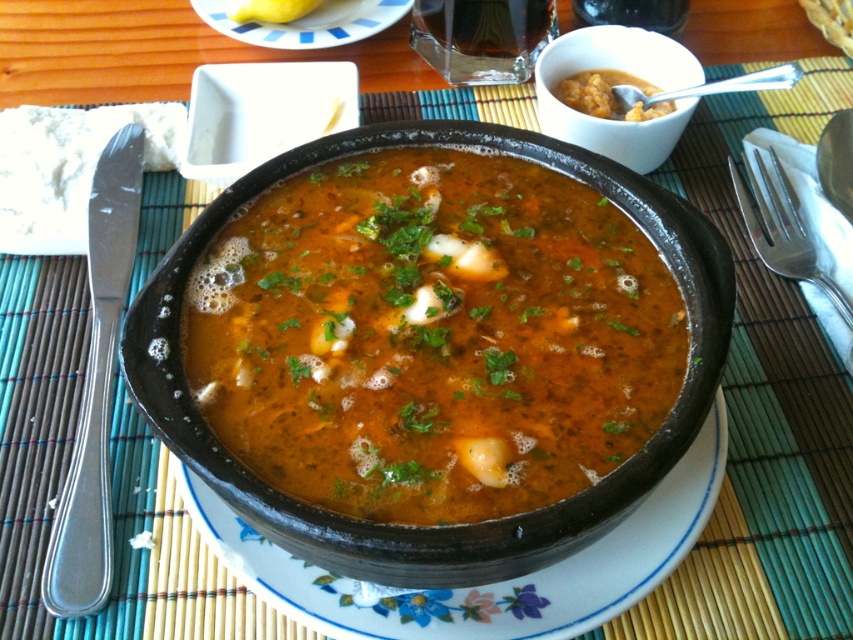
Question: Can you confirm if satin silver knife at left is bigger than brown matte soup at upper center?

Choices:
 (A) no
 (B) yes

Answer: (B)

Question: Which point is farther to the camera?

Choices:
 (A) brown matte soup at upper center
 (B) white matte bowl at upper right
 (C) white ceramic plate at upper center

Answer: (C)

Question: Is brown matte soup at center closer to camera compared to white matte bowl at upper right?

Choices:
 (A) yes
 (B) no

Answer: (A)

Question: Observing the image, what is the correct spatial positioning of brown matte soup at center in reference to white ceramic plate at upper center?

Choices:
 (A) left
 (B) right

Answer: (B)

Question: Which object is positioned farthest from the brown matte soup at upper center?

Choices:
 (A) satin silver knife at left
 (B) white matte bowl at upper right

Answer: (A)

Question: Which object is closer to the camera taking this photo?

Choices:
 (A) brown matte soup at center
 (B) brown matte soup at upper center

Answer: (A)